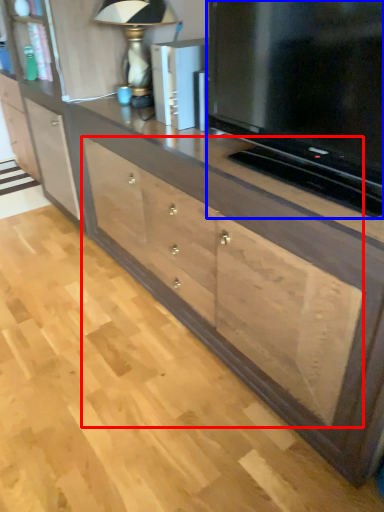
Question: Which object appears farthest to the camera in this image, drawer (highlighted by a red box) or television (highlighted by a blue box)?

Choices:
 (A) drawer
 (B) television

Answer: (A)